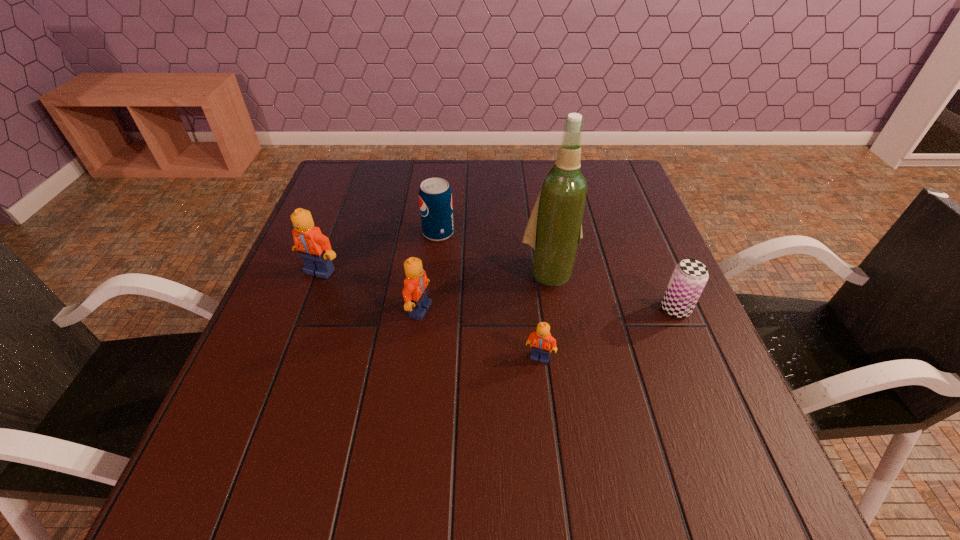
Locate an element on the screen. Image resolution: width=960 pixels, height=540 pixels. blank space located 0.120m on the front-facing side of the leftmost object is located at coordinates (302, 319).

The width and height of the screenshot is (960, 540). Find the location of `blank area located 0.230m on the front-facing side of the second Lego from right to left`. blank area located 0.230m on the front-facing side of the second Lego from right to left is located at coordinates (537, 310).

Locate an element on the screen. Image resolution: width=960 pixels, height=540 pixels. vacant region located 0.100m on the front-facing side of the shortest Lego is located at coordinates (546, 411).

At what (x,y) coordinates should I click in order to perform the action: click on vacant position located 0.310m on the back of the beer can. Please return your answer as a coordinate pair (x, y). The height and width of the screenshot is (540, 960). Looking at the image, I should click on (636, 216).

This screenshot has width=960, height=540. I want to click on free region located 0.120m on the front of the farthest object, so click(x=434, y=275).

Locate an element on the screen. This screenshot has height=540, width=960. vacant area situated 0.280m on the front-facing side of the tallest object is located at coordinates (571, 403).

This screenshot has height=540, width=960. What are the coordinates of `object that is positioned at the left edge` in the screenshot? It's located at (x=314, y=248).

Identify the location of object present at the right edge. The width and height of the screenshot is (960, 540). (690, 276).

The width and height of the screenshot is (960, 540). Identify the location of free space at the far edge. (424, 174).

Where is `free space at the near edge of the desktop`? free space at the near edge of the desktop is located at coordinates (490, 438).